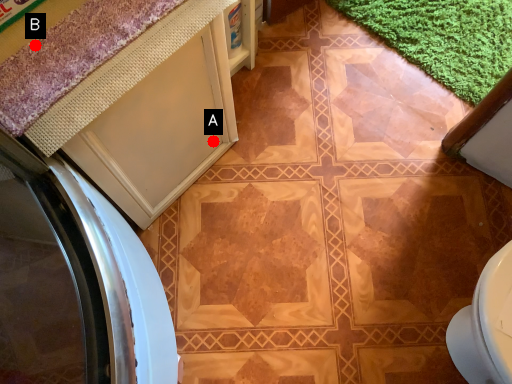
Question: Two points are circled on the image, labeled by A and B beside each circle. Which point is closer to the camera?

Choices:
 (A) A is closer
 (B) B is closer

Answer: (B)